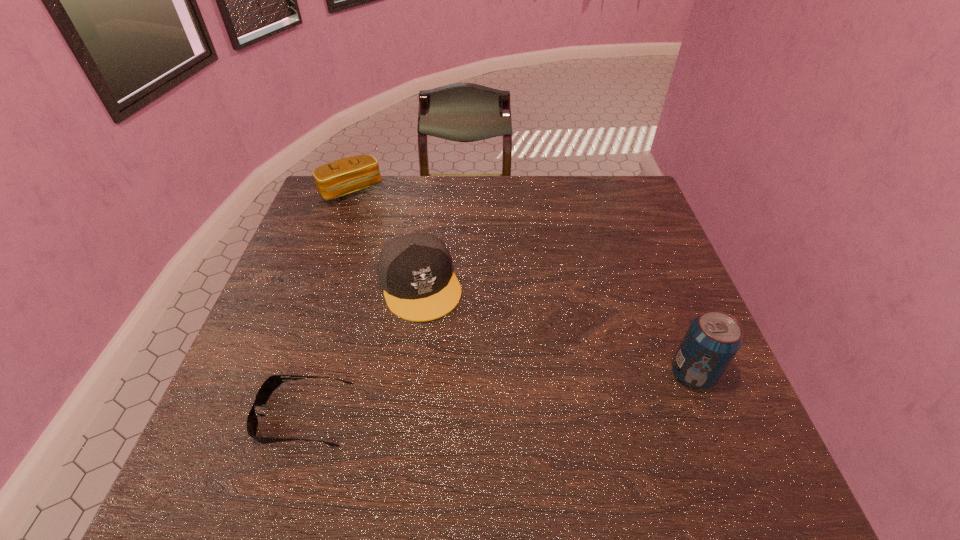
At what (x,y) coordinates should I click in order to perform the action: click on vacant region that satisfies the following two spatial constraints: 1. on the front side of the rightmost object; 2. on the right side of the cap. Please return your answer as a coordinate pair (x, y). Image resolution: width=960 pixels, height=540 pixels. Looking at the image, I should click on point(408,374).